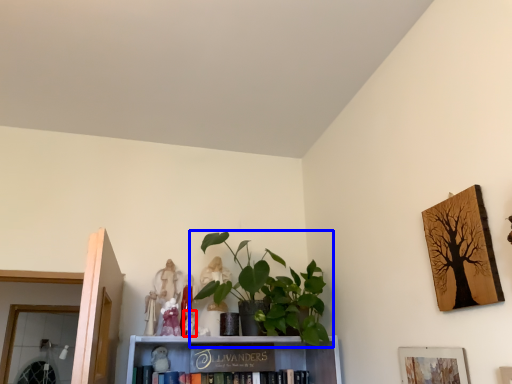
Question: Which of the following is the farthest to the observer, toy (highlighted by a red box) or houseplant (highlighted by a blue box)?

Choices:
 (A) toy
 (B) houseplant

Answer: (A)